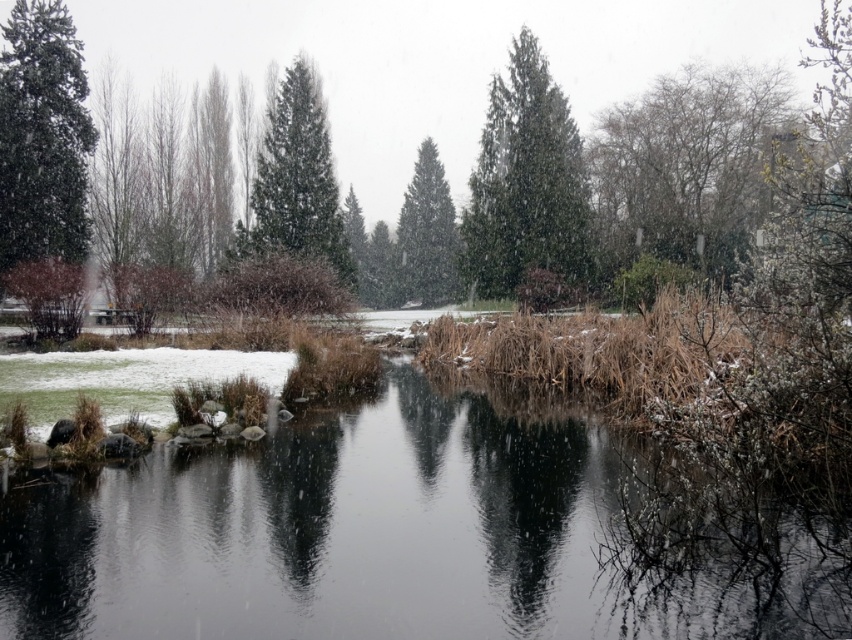
Question: Which object is the farthest from the bare branches at upper right?

Choices:
 (A) green matte tree at center
 (B) green textured pine tree at center
 (C) green matte evergreen tree at left

Answer: (C)

Question: Does green textured evergreen tree at center have a smaller size compared to green matte tree at center?

Choices:
 (A) yes
 (B) no

Answer: (B)

Question: Which point is farther to the camera?

Choices:
 (A) green matte evergreen tree at left
 (B) green textured evergreen tree at center
 (C) green matte tree at center
 (D) green textured pine tree at center

Answer: (C)

Question: Is bare branches at upper right bigger than green textured evergreen tree at center?

Choices:
 (A) no
 (B) yes

Answer: (A)

Question: Does bare branches at upper right have a greater width compared to green matte evergreen tree at left?

Choices:
 (A) no
 (B) yes

Answer: (B)

Question: Which object appears farthest from the camera in this image?

Choices:
 (A) green textured pine tree at center
 (B) bare branches at upper right

Answer: (A)